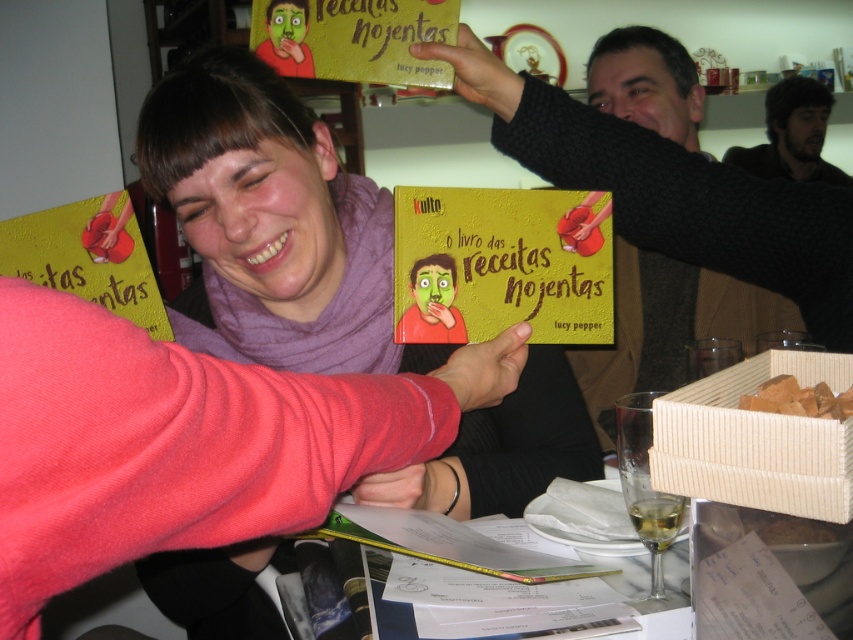
Question: Which point is farther to the camera?

Choices:
 (A) dark brown hair at upper right
 (B) beige woven basket at lower right

Answer: (A)

Question: Does beige woven basket at lower right have a greater width compared to dark brown hair at upper right?

Choices:
 (A) no
 (B) yes

Answer: (A)

Question: Among these objects, which one is nearest to the camera?

Choices:
 (A) dark brown hair at upper right
 (B) beige woven basket at lower right

Answer: (B)

Question: In this image, where is beige woven basket at lower right located relative to dark brown hair at upper right?

Choices:
 (A) above
 (B) below

Answer: (B)

Question: Does beige woven basket at lower right come behind dark brown hair at upper right?

Choices:
 (A) yes
 (B) no

Answer: (B)

Question: Which point is farther to the camera?

Choices:
 (A) dark brown hair at upper right
 (B) beige woven basket at lower right

Answer: (A)